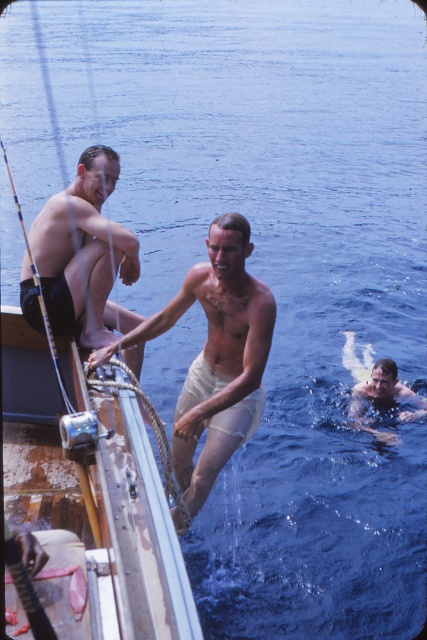
Does point (5, 307) come farther from viewer compared to point (363, 428)?

No, it is not.

Does wooden boat at left appear on the right side of smooth skin man at lower right?

In fact, wooden boat at left is to the left of smooth skin man at lower right.

This screenshot has width=427, height=640. Describe the element at coordinates (93, 499) in the screenshot. I see `wooden boat at left` at that location.

Where is `wooden boat at left`? Image resolution: width=427 pixels, height=640 pixels. wooden boat at left is located at coordinates pyautogui.click(x=93, y=499).

Which is above, tan fabric shorts at center or smooth skin man at lower right?

tan fabric shorts at center is above.

Locate an element on the screen. tan fabric shorts at center is located at coordinates (215, 355).

Who is lower down, wooden boat at left or matte black shorts at left?

Positioned lower is wooden boat at left.

Between point (140, 445) and point (37, 301), which one is positioned behind?

The point (37, 301) is behind.

Who is more distant from viewer, (125, 525) or (104, 225)?

The point (104, 225) is more distant.

Locate an element on the screen. The width and height of the screenshot is (427, 640). wooden boat at left is located at coordinates (93, 499).